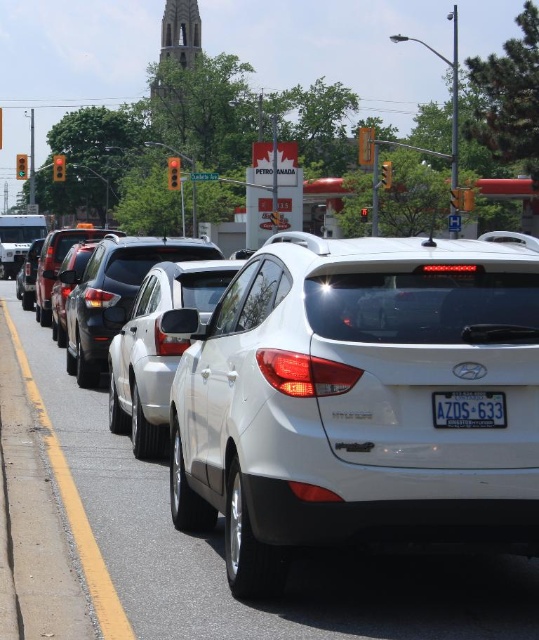
You are a delivery driver who needs to park your truck between the satin silver sedan at center and the green glass traffic light at center. Given the space constraints, can you safely maneuver your truck into this spot?

The satin silver sedan at center occupies less space than green glass traffic light at center. However, the total available space between them may still be insufficient for a truck. Without exact measurements, it is risky to attempt parking here.

You are a delivery driver trying to navigate through the traffic jam at the gas station. You notice a shiny black sedan at center and a yellow matte traffic light at upper center. Which object is wider?

The shiny black sedan at center is wider than the yellow matte traffic light at upper center.